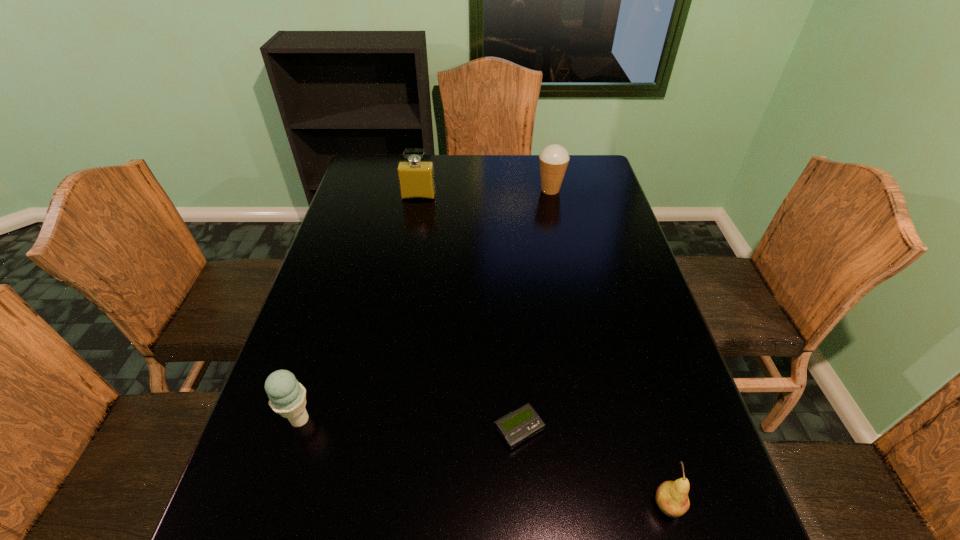
In the image, there is a desktop. Find the location of `vacant space at the left edge`. vacant space at the left edge is located at coordinates (388, 206).

You are a GUI agent. You are given a task and a screenshot of the screen. Output one action in this format:
    pyautogui.click(x=<x>, y=<y>)
    Task: Click on the free space at the right edge
    This screenshot has width=960, height=540.
    Given the screenshot: What is the action you would take?
    pyautogui.click(x=651, y=406)

In the image, there is a desktop. Where is `vacant space at the far left corner`? The image size is (960, 540). vacant space at the far left corner is located at coordinates (382, 179).

Where is `empty space between the fourth object from right to left and the beeper`? empty space between the fourth object from right to left and the beeper is located at coordinates (468, 313).

The image size is (960, 540). In order to click on empty space between the beeper and the nearer ice cream in this screenshot , I will do `click(409, 424)`.

You are a GUI agent. You are given a task and a screenshot of the screen. Output one action in this format:
    pyautogui.click(x=<x>, y=<y>)
    Task: Click on the vacant space in between the beeper and the perfume
    
    Given the screenshot: What is the action you would take?
    pyautogui.click(x=468, y=313)

You are a GUI agent. You are given a task and a screenshot of the screen. Output one action in this format:
    pyautogui.click(x=<x>, y=<y>)
    Task: Click on the unoccupied position between the third object from right to left and the second shortest object
    
    Given the screenshot: What is the action you would take?
    (593, 467)

What are the coordinates of `vacant space that's between the farther ice cream and the rightmost object` in the screenshot? It's located at (610, 347).

Identify the location of vacant point located between the rightmost object and the third object from left to right. (593, 467).

Where is `empty space that is in between the perfume and the beeper`? empty space that is in between the perfume and the beeper is located at coordinates (468, 313).